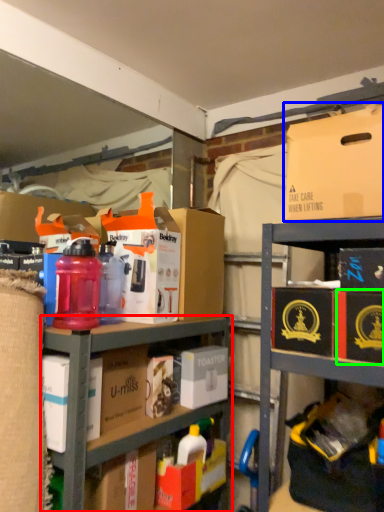
Question: Which is farther away from shelf (highlighted by a red box)? box (highlighted by a blue box) or storage box (highlighted by a green box)?

Choices:
 (A) box
 (B) storage box

Answer: (A)